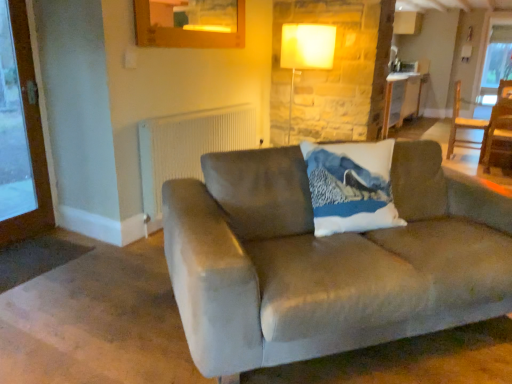
Question: Relative to wooden table at center, is suede couch at center in front or behind?

Choices:
 (A) behind
 (B) front

Answer: (B)

Question: Considering the positions of suede couch at center and wooden table at center in the image, is suede couch at center wider or thinner than wooden table at center?

Choices:
 (A) wide
 (B) thin

Answer: (A)

Question: Which of these objects is positioned closest to the suede couch at center?

Choices:
 (A) matte white lamp at upper center
 (B) wooden table at center
 (C) wooden screen door at left
 (D) wooden chair at right
 (E) white textured radiator at upper center

Answer: (E)

Question: Which object is the farthest from the white textured radiator at upper center?

Choices:
 (A) suede couch at center
 (B) wooden chair at right
 (C) wooden screen door at left
 (D) wooden table at center
 (E) matte white lamp at upper center

Answer: (B)